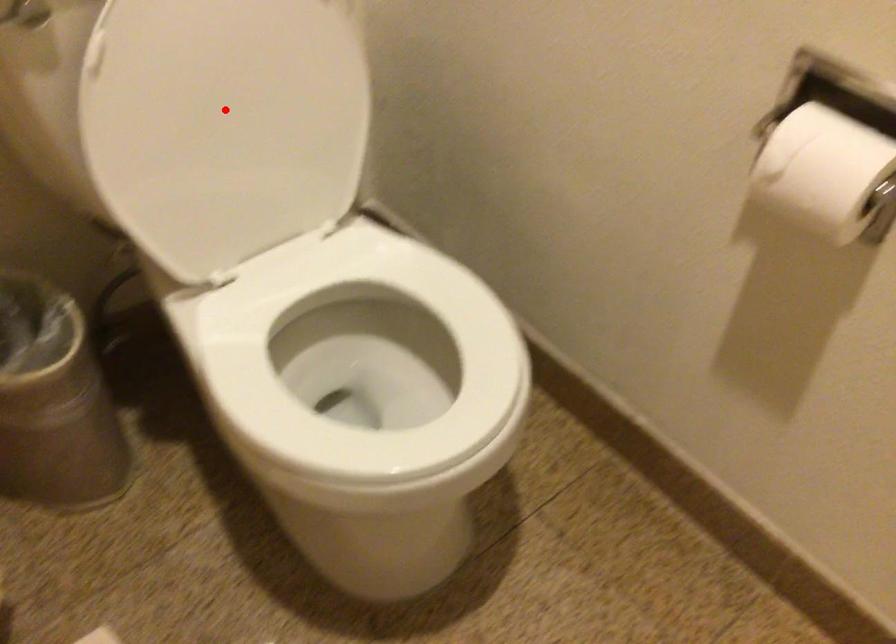
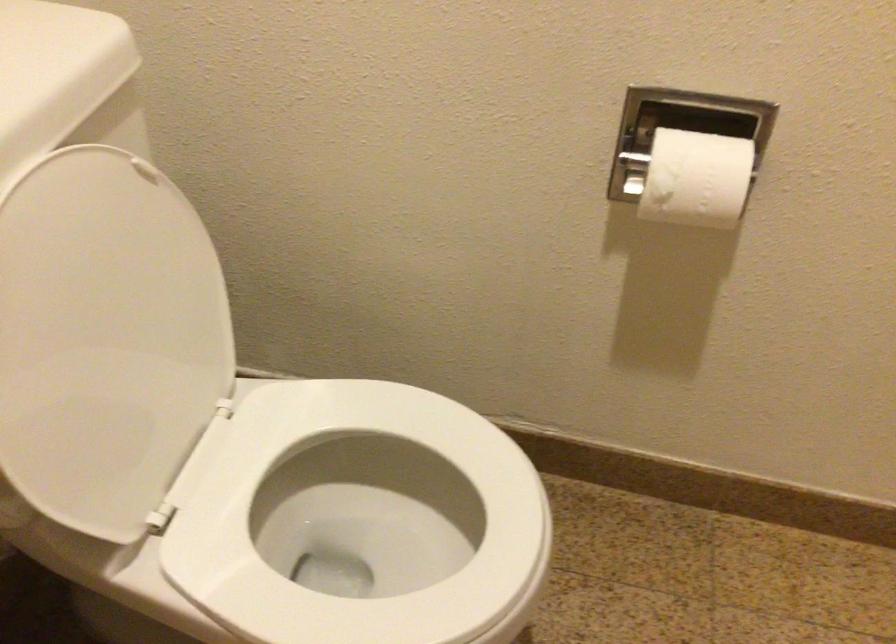
Question: A red point is marked in image1. In image2, is the corresponding 3D point closer to the camera or farther? Reply with the corresponding letter.

Choices:
 (A) The corresponding 3D point is closer.
 (B) The corresponding 3D point is farther.

Answer: (A)